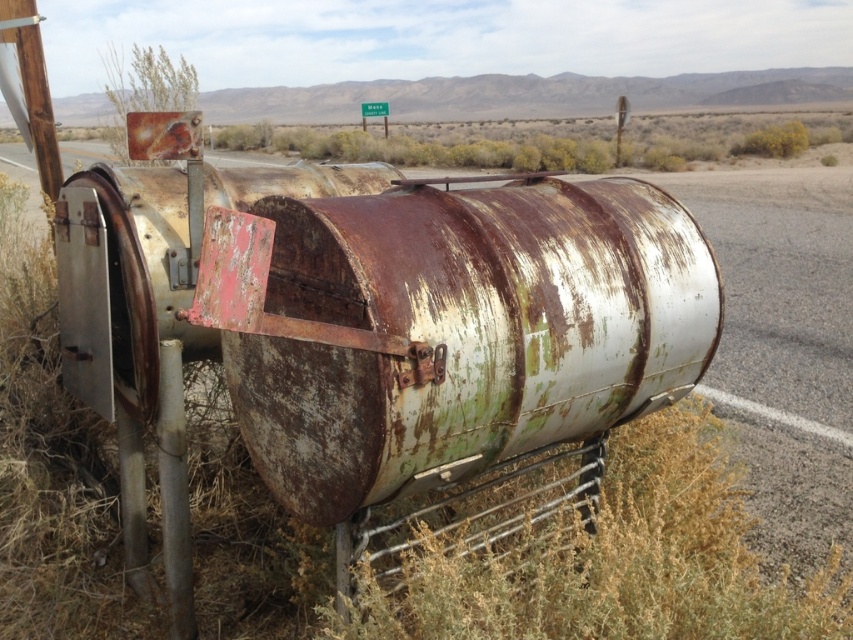
Is point (624, 461) behind point (134, 48)?

No, it is in front of (134, 48).

Can you confirm if green matte weed at lower right is positioned to the right of rusty metal weed at upper left?

Indeed, green matte weed at lower right is positioned on the right side of rusty metal weed at upper left.

The width and height of the screenshot is (853, 640). In order to click on green matte weed at lower right in this screenshot , I will do `click(596, 556)`.

Is green matte weed at lower right above rusty metal pole at lower left?

No, green matte weed at lower right is not above rusty metal pole at lower left.

The width and height of the screenshot is (853, 640). What are the coordinates of `green matte weed at lower right` in the screenshot? It's located at (596, 556).

Does rusty metal pole at lower left have a lesser width compared to rusty metal weed at upper left?

Correct, rusty metal pole at lower left's width is less than rusty metal weed at upper left's.

Does rusty metal pole at lower left appear under rusty metal weed at upper left?

Yes, rusty metal pole at lower left is below rusty metal weed at upper left.

Is point (195, 627) positioned in front of point (141, 108)?

Yes, it is in front of point (141, 108).

The width and height of the screenshot is (853, 640). What are the coordinates of `rusty metal pole at lower left` in the screenshot? It's located at (173, 490).